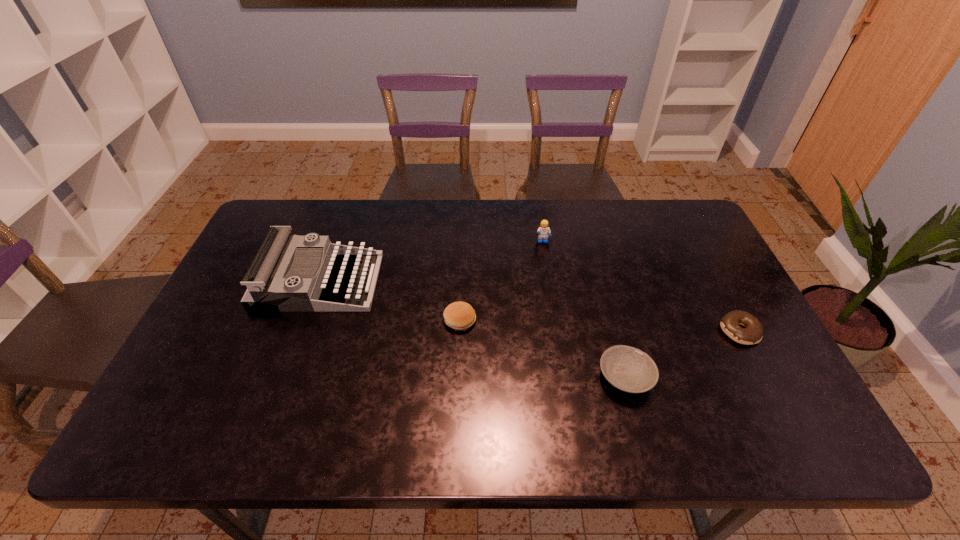
You are a GUI agent. You are given a task and a screenshot of the screen. Output one action in this format:
    pyautogui.click(x=<x>, y=<y>)
    Task: Click on the blank area located 0.350m on the left of the patty
    The height and width of the screenshot is (540, 960).
    Given the screenshot: What is the action you would take?
    pyautogui.click(x=314, y=320)

The image size is (960, 540). Find the location of `vacant space located 0.350m on the back of the fourth object from left to right`. vacant space located 0.350m on the back of the fourth object from left to right is located at coordinates (594, 260).

Locate an element on the screen. vacant area situated on the left of the rightmost object is located at coordinates (655, 331).

The height and width of the screenshot is (540, 960). In order to click on object that is at the far edge in this screenshot , I will do `click(543, 231)`.

Find the location of a particular element. The height and width of the screenshot is (540, 960). object that is positioned at the left edge is located at coordinates (270, 287).

You are a GUI agent. You are given a task and a screenshot of the screen. Output one action in this format:
    pyautogui.click(x=<x>, y=<y>)
    Task: Click on the object that is at the right edge
    
    Given the screenshot: What is the action you would take?
    pyautogui.click(x=752, y=334)

The width and height of the screenshot is (960, 540). Identify the location of vacant space at the far edge. (556, 206).

This screenshot has width=960, height=540. Find the location of `free space at the near edge of the desktop`. free space at the near edge of the desktop is located at coordinates (506, 449).

Where is `vacant region at the left edge`? The width and height of the screenshot is (960, 540). vacant region at the left edge is located at coordinates (263, 319).

Find the location of a particular element. Image resolution: width=960 pixels, height=540 pixels. vacant space at the right edge of the desktop is located at coordinates (717, 266).